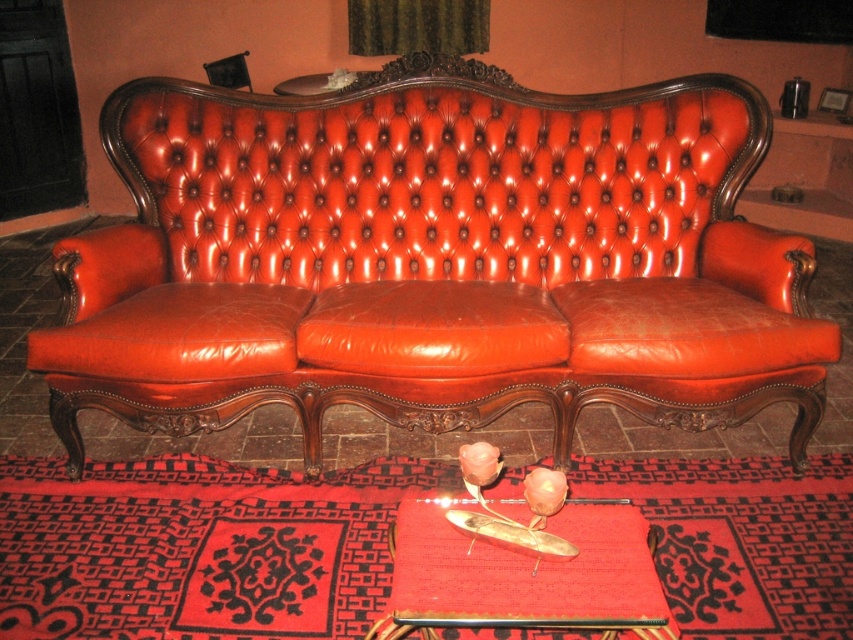
Question: Is shiny leather couch at center further to the viewer compared to smooth leather pad at center?

Choices:
 (A) yes
 (B) no

Answer: (A)

Question: Which point is farther to the camera?

Choices:
 (A) (399, 536)
 (B) (706, 179)

Answer: (B)

Question: Which point is closer to the camera?

Choices:
 (A) (701, 372)
 (B) (442, 506)

Answer: (B)

Question: Is shiny leather couch at center to the left of smooth leather pad at center from the viewer's perspective?

Choices:
 (A) no
 (B) yes

Answer: (B)

Question: Is shiny leather couch at center bigger than smooth leather pad at center?

Choices:
 (A) no
 (B) yes

Answer: (B)